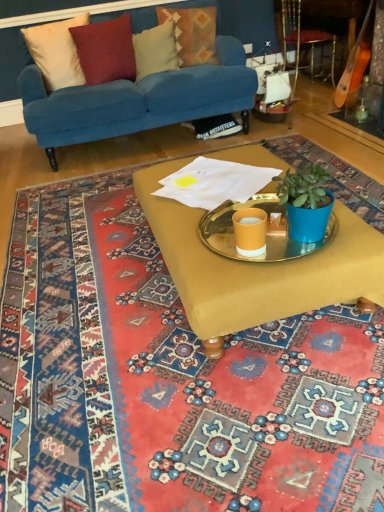
Question: From a real-world perspective, is textured woolen pillow at upper center, the first pillow viewed from the right, above or below wooden acoustic guitar at right?

Choices:
 (A) above
 (B) below

Answer: (A)

Question: Is point (157, 11) positioned closer to the camera than point (367, 53)?

Choices:
 (A) farther
 (B) closer

Answer: (A)

Question: Based on their relative distances, which object is nearer to the velvet cushion at upper center, the 3th pillow from the left?

Choices:
 (A) metallic gold armchair at upper right
 (B) velvet cushion at upper left, which is the first pillow from left to right
 (C) matte gold coffee table at center
 (D) velvet blue couch at upper center
 (E) textured woolen pillow at upper center, the first pillow viewed from the right

Answer: (E)

Question: Estimate the real-world distances between objects in this image. Which object is farther from the metallic gold armchair at upper right?

Choices:
 (A) carpeted rug at center
 (B) wooden acoustic guitar at right
 (C) velvet cushion at upper center, the 3th pillow from the left
 (D) velvet cushion at upper left, which is the first pillow from left to right
 (E) textured woolen pillow at upper center, the first pillow viewed from the right

Answer: (A)